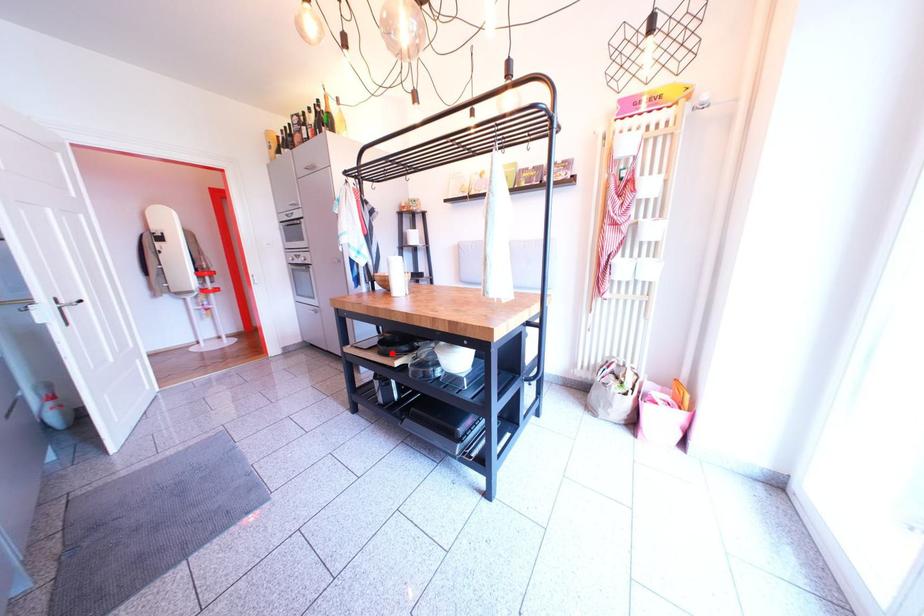
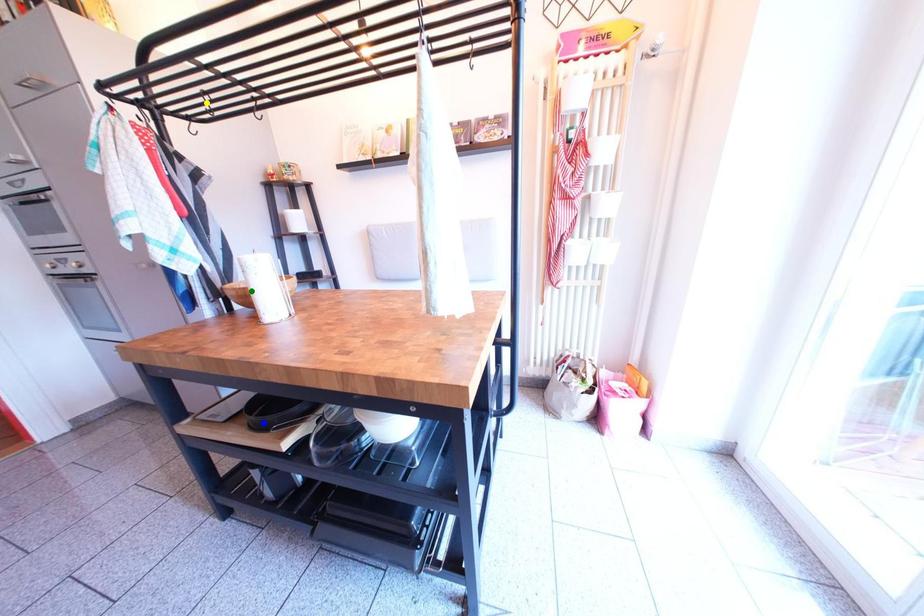
Question: I am providing you with two images of the same scene from different viewpoints. A red point is marked on the first image. You are given multiple points on the second image. Can you choose the point in image 2 that corresponds to the point in image 1?

Choices:
 (A) green point
 (B) yellow point
 (C) blue point

Answer: (C)